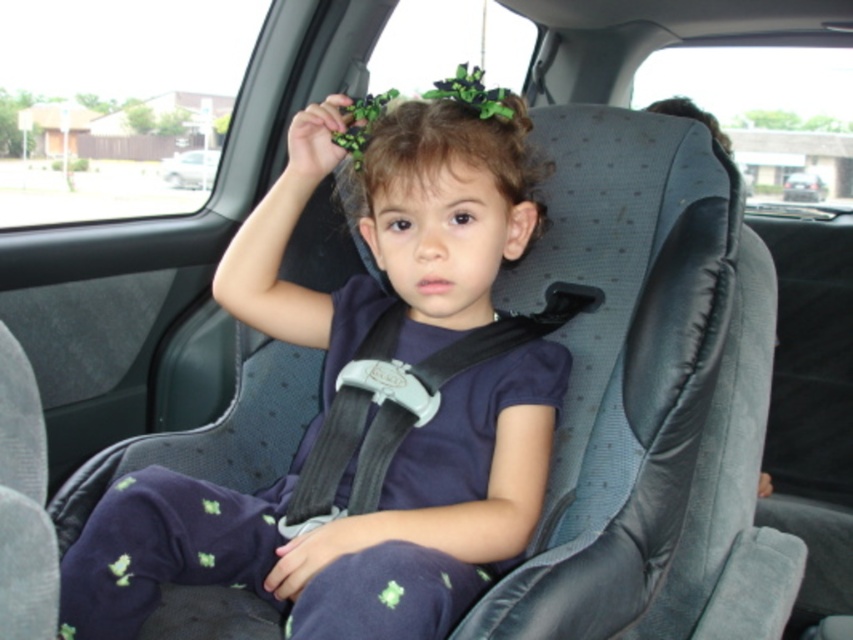
Which of these two, matte black car seat at center or silver metallic car at center, stands taller?

matte black car seat at center is taller.

Does matte black car seat at center have a greater height compared to silver metallic car at center?

Indeed, matte black car seat at center has a greater height compared to silver metallic car at center.

This screenshot has width=853, height=640. Identify the location of matte black car seat at center. (341, 524).

Does black fabric seatbelt at center have a lesser width compared to dark brown hair at center?

In fact, black fabric seatbelt at center might be wider than dark brown hair at center.

Does black fabric seatbelt at center have a smaller size compared to dark brown hair at center?

Incorrect, black fabric seatbelt at center is not smaller in size than dark brown hair at center.

Describe the element at coordinates (396, 403) in the screenshot. This screenshot has width=853, height=640. I see `black fabric seatbelt at center` at that location.

What are the coordinates of `black fabric seatbelt at center` in the screenshot? It's located at (396, 403).

Which is above, dark brown hair at center or silver metallic car at center?

silver metallic car at center is higher up.

Is point (463, 118) more distant than point (178, 161)?

No, it is not.

Locate an element on the screen. The image size is (853, 640). dark brown hair at center is located at coordinates (453, 154).